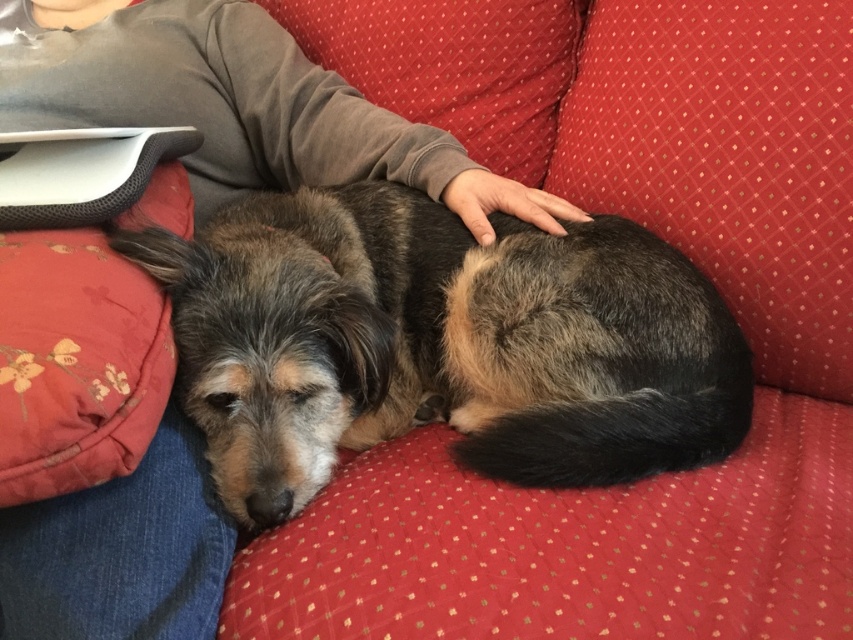
Between brown fur dog at center and floral-patterned fabric pillow at lower left, which one has more height?

brown fur dog at center

Who is higher up, brown fur dog at center or floral-patterned fabric pillow at lower left?

floral-patterned fabric pillow at lower left

Does point (657, 372) come in front of point (106, 282)?

That is False.

In order to click on brown fur dog at center in this screenshot , I will do `click(440, 342)`.

Does brown fur dog at center have a lesser height compared to gray fleece sweater at upper left?

No, brown fur dog at center is not shorter than gray fleece sweater at upper left.

Does brown fur dog at center appear on the left side of gray fleece sweater at upper left?

In fact, brown fur dog at center is to the right of gray fleece sweater at upper left.

Find the location of a particular element. This screenshot has height=640, width=853. brown fur dog at center is located at coordinates (440, 342).

The height and width of the screenshot is (640, 853). I want to click on brown fur dog at center, so click(x=440, y=342).

Is gray fleece sweater at upper left below floral-patterned fabric pillow at lower left?

No.

Which is behind, point (196, 512) or point (83, 486)?

Point (196, 512)

At what (x,y) coordinates should I click in order to perform the action: click on gray fleece sweater at upper left. Please return your answer as a coordinate pair (x, y). Image resolution: width=853 pixels, height=640 pixels. Looking at the image, I should click on (245, 108).